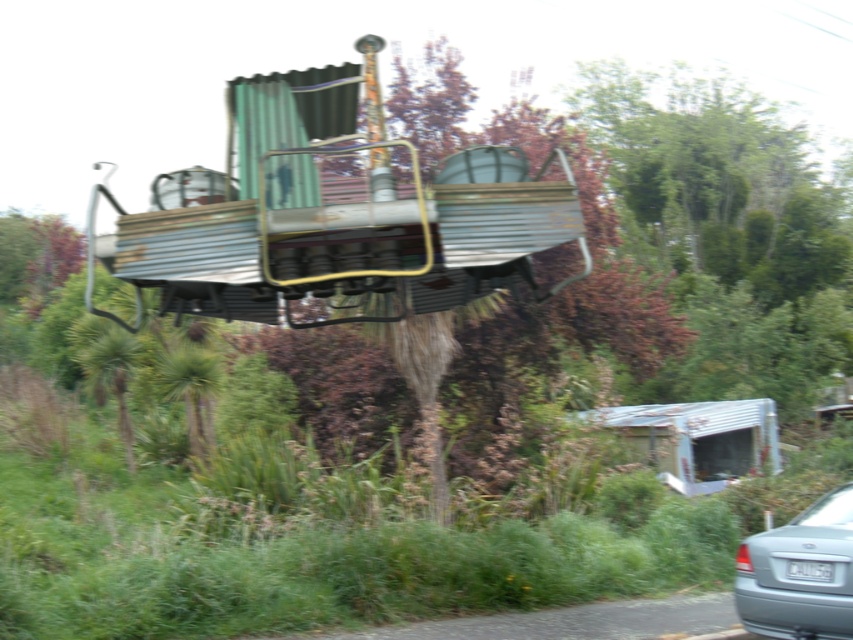
Question: Which point is farther to the camera?

Choices:
 (A) corrugated metal train car at center
 (B) silver metallic car at lower right

Answer: (A)

Question: Does corrugated metal train car at center lie in front of silver metallic car at lower right?

Choices:
 (A) no
 (B) yes

Answer: (A)

Question: Is corrugated metal train car at center above silver metallic car at lower right?

Choices:
 (A) yes
 (B) no

Answer: (A)

Question: Among these points, which one is nearest to the camera?

Choices:
 (A) (393, 276)
 (B) (846, 545)

Answer: (A)

Question: Observing the image, what is the correct spatial positioning of corrugated metal train car at center in reference to silver metallic car at lower right?

Choices:
 (A) below
 (B) above

Answer: (B)